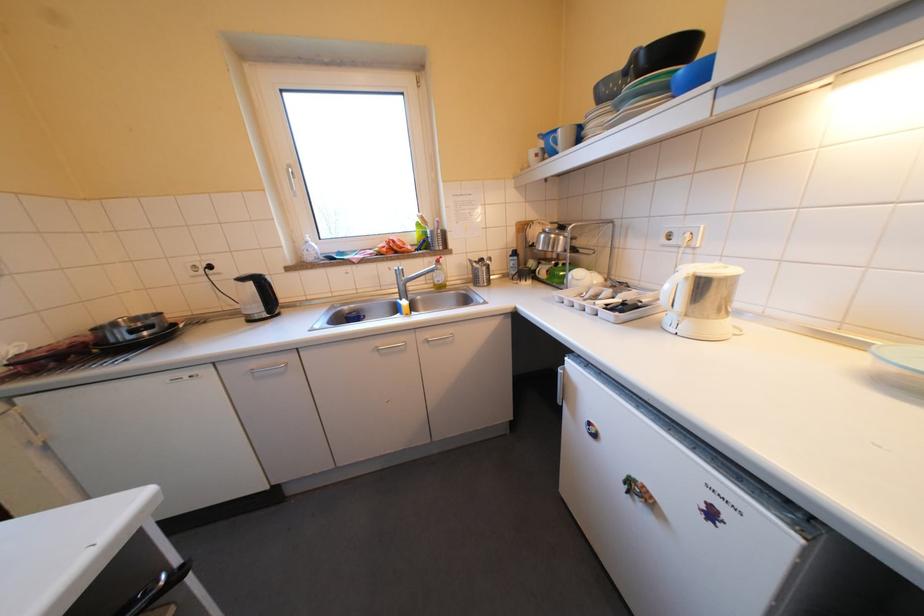
Where would you lift the black kettle handle? Please return your answer as a coordinate pair (x, y).

(159, 586)